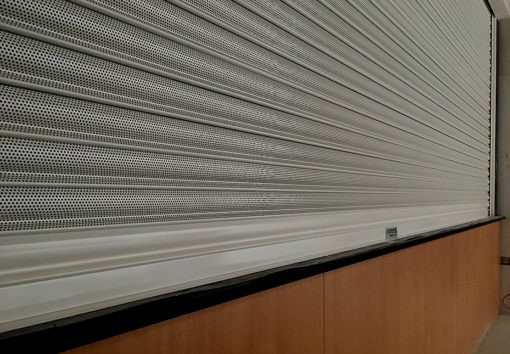
Locate an element on the screen. The width and height of the screenshot is (510, 354). floor is located at coordinates point(496,336).